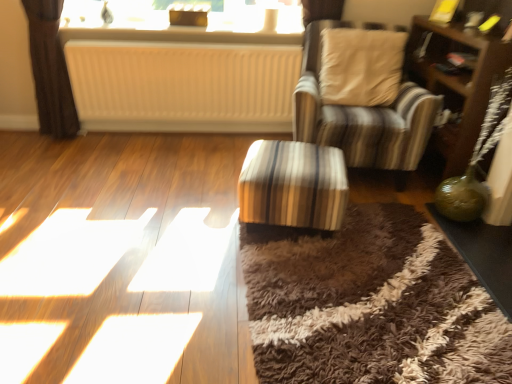
Where is `vacant space situated on the left part of green glass table at lower right, arranged as the first table when viewed from the right`? The image size is (512, 384). vacant space situated on the left part of green glass table at lower right, arranged as the first table when viewed from the right is located at coordinates (395, 263).